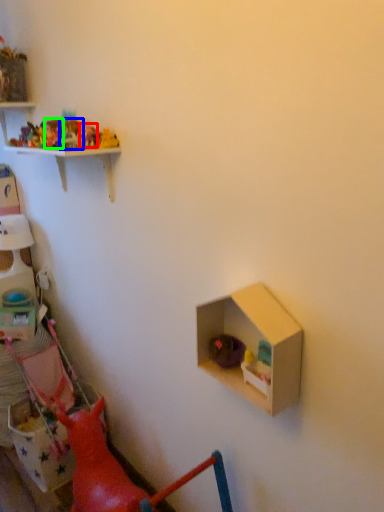
Question: Estimate the real-world distances between objects in this image. Which object is farther from toy (highlighted by a red box), toy (highlighted by a blue box) or toy (highlighted by a green box)?

Choices:
 (A) toy
 (B) toy

Answer: (B)